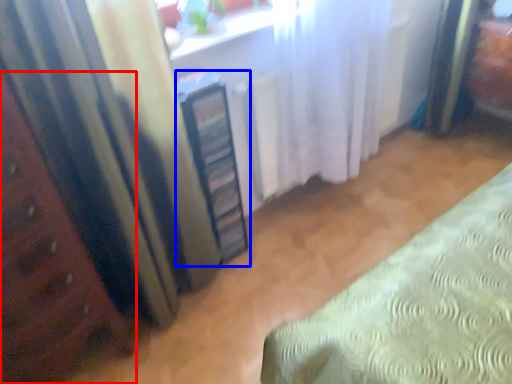
Question: Which object is closer to the camera taking this photo, furniture (highlighted by a red box) or cabinetry (highlighted by a blue box)?

Choices:
 (A) furniture
 (B) cabinetry

Answer: (A)